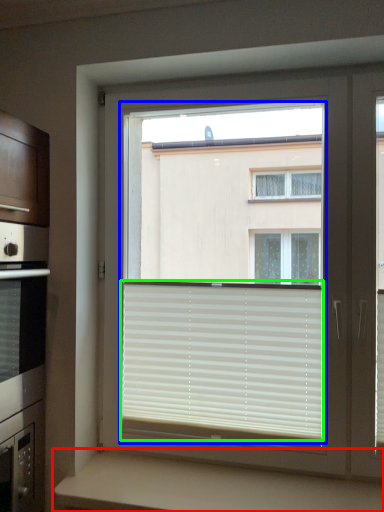
Question: Which object is positioned farthest from counter (highlighted by a red box)? Select from bay window (highlighted by a blue box) and window blind (highlighted by a green box).

Choices:
 (A) bay window
 (B) window blind

Answer: (A)